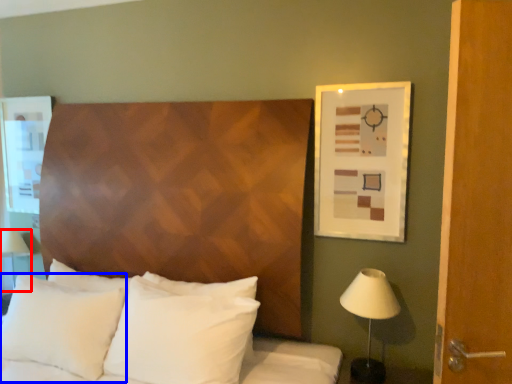
Question: Which object is further to the camera taking this photo, table lamp (highlighted by a red box) or pillow (highlighted by a blue box)?

Choices:
 (A) table lamp
 (B) pillow

Answer: (A)